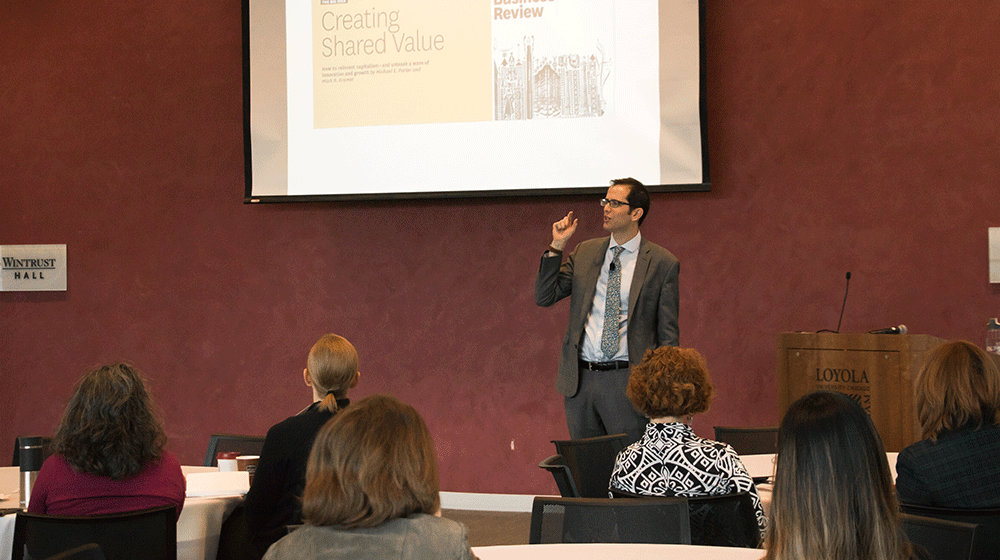
You are a GUI agent. You are given a task and a screenshot of the screen. Output one action in this format:
    pyautogui.click(x=<x>, y=<y>)
    Task: Click on the speaker
    The width and height of the screenshot is (1000, 560).
    Given the screenshot: What is the action you would take?
    pyautogui.click(x=612, y=275)